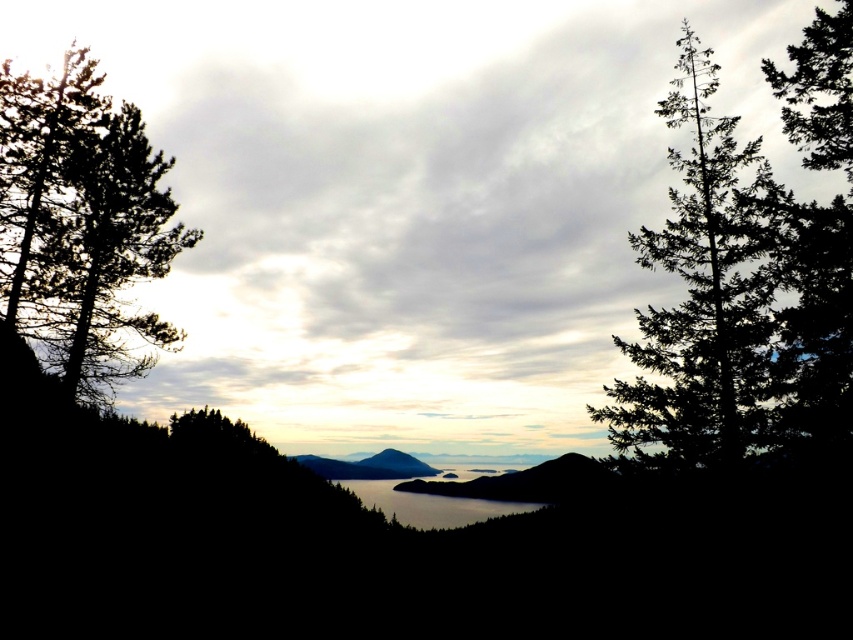
Question: Does green needle-like tree at right appear on the right side of clear water at center?

Choices:
 (A) yes
 (B) no

Answer: (A)

Question: Is green matte tree at left thinner than green textured tree at right?

Choices:
 (A) yes
 (B) no

Answer: (A)

Question: Which point is closer to the camera taking this photo?

Choices:
 (A) (816, 321)
 (B) (144, 317)
 (C) (693, 321)

Answer: (A)

Question: Which of the following is the closest to the observer?

Choices:
 (A) (271, 120)
 (B) (645, 257)

Answer: (B)

Question: Is cloudy sky at center to the right of green textured tree at right from the viewer's perspective?

Choices:
 (A) yes
 (B) no

Answer: (B)

Question: Which object is the farthest from the clear water at center?

Choices:
 (A) green needle-like tree at right
 (B) green matte tree at left
 (C) cloudy sky at center

Answer: (B)